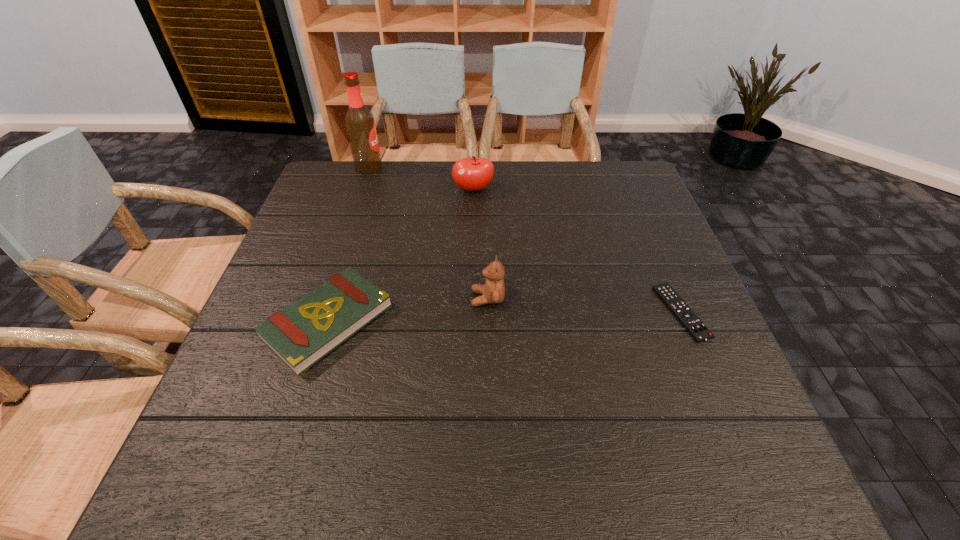
This screenshot has width=960, height=540. I want to click on beer bottle, so click(x=360, y=124).

At what (x,y) coordinates should I click in order to perform the action: click on the farthest object. Please return your answer as a coordinate pair (x, y). Looking at the image, I should click on (360, 124).

The height and width of the screenshot is (540, 960). I want to click on the fourth nearest object, so click(x=474, y=173).

Locate an element on the screen. The width and height of the screenshot is (960, 540). teddy bear is located at coordinates click(x=493, y=291).

Image resolution: width=960 pixels, height=540 pixels. In order to click on the fourth tallest object in this screenshot , I will do `click(301, 334)`.

At what (x,y) coordinates should I click in order to perform the action: click on the shortest object. Please return your answer as a coordinate pair (x, y). Looking at the image, I should click on (697, 329).

You are a GUI agent. You are given a task and a screenshot of the screen. Output one action in this format:
    pyautogui.click(x=<x>, y=<y>)
    Task: Click on the remote control
    The height and width of the screenshot is (540, 960).
    Given the screenshot: What is the action you would take?
    pyautogui.click(x=697, y=329)

I want to click on vacant region located on the right of the beer bottle, so click(482, 168).

Image resolution: width=960 pixels, height=540 pixels. I want to click on vacant area situated 0.210m on the right of the second farthest object, so click(x=565, y=190).

The height and width of the screenshot is (540, 960). Find the location of `free spot located on the face of the teddy bear`. free spot located on the face of the teddy bear is located at coordinates (297, 298).